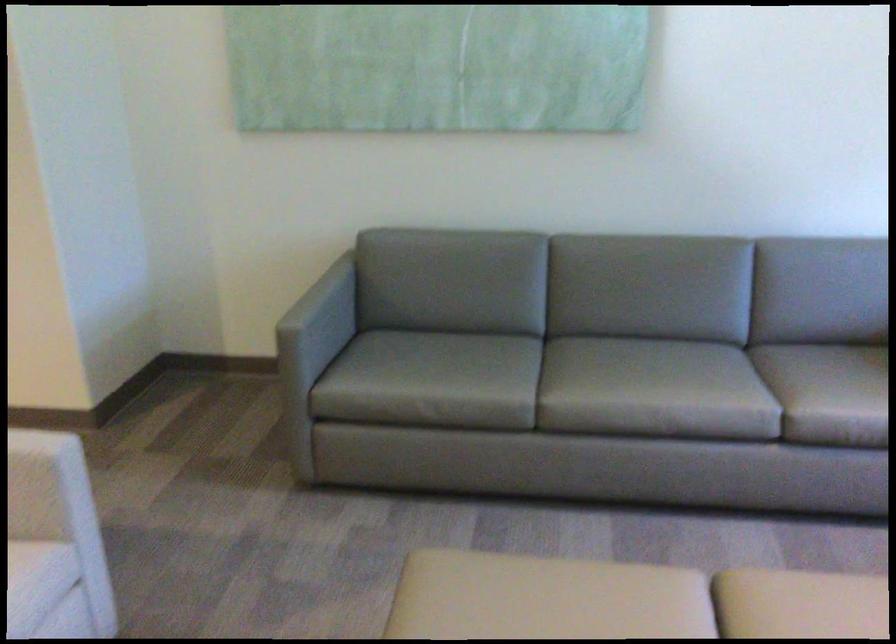
What do you see at coordinates (55, 542) in the screenshot?
I see `a chair sitting surface` at bounding box center [55, 542].